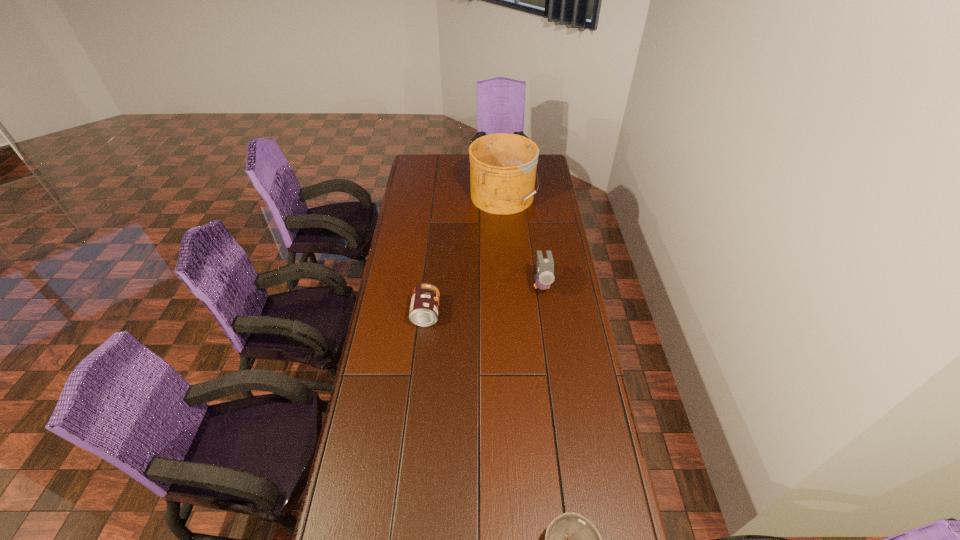
The width and height of the screenshot is (960, 540). What are the coordinates of `the tallest object` in the screenshot? It's located at (503, 166).

Identify the location of the farthest object. (503, 166).

Where is `the third nearest object`? the third nearest object is located at coordinates (545, 266).

Where is `bird`? This screenshot has width=960, height=540. bird is located at coordinates (545, 266).

Identify the location of the second shortest object. The height and width of the screenshot is (540, 960). (424, 307).

The width and height of the screenshot is (960, 540). In order to click on the third farthest object in this screenshot , I will do `click(424, 307)`.

Locate an element on the screen. blank space located 0.080m on the back of the farthest object is located at coordinates (501, 170).

Locate an element on the screen. vacant space located at the beak of the bird is located at coordinates (545, 312).

Identify the location of blank area located on the front label of the third farthest object. (508, 314).

In order to click on object situated at the left edge in this screenshot , I will do [424, 307].